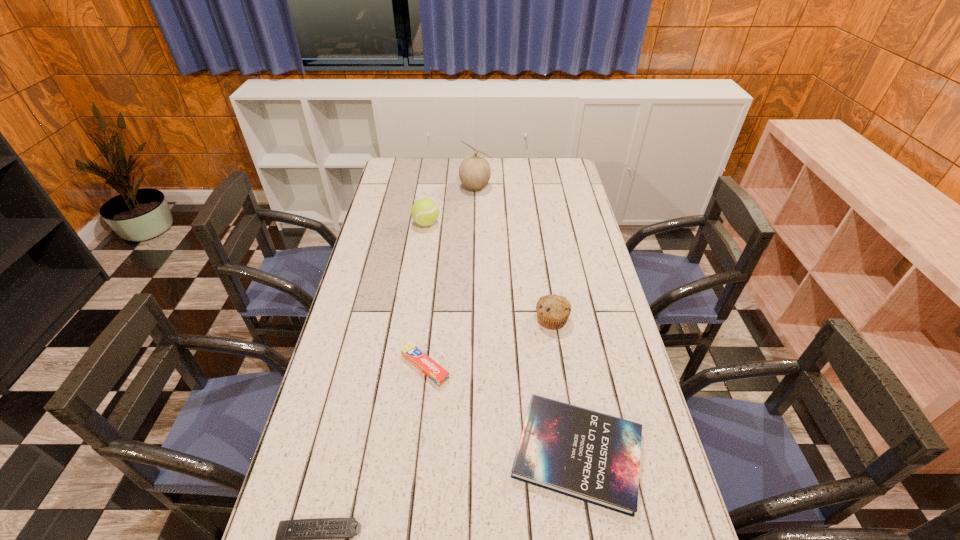
Where is `free space located on the right of the muffin`? The width and height of the screenshot is (960, 540). free space located on the right of the muffin is located at coordinates (600, 319).

I want to click on vacant area located 0.340m on the front of the fourth farthest object, so pos(409,517).

What are the coordinates of `free point located on the left of the second nearest object` in the screenshot? It's located at (449, 453).

Locate an element on the screen. This screenshot has width=960, height=540. object that is at the far edge is located at coordinates (474, 172).

The width and height of the screenshot is (960, 540). I want to click on muffin located at the right edge, so click(x=553, y=311).

Identify the location of hardback book that is at the right edge. (594, 457).

The height and width of the screenshot is (540, 960). I want to click on free space at the far edge, so click(x=538, y=181).

The height and width of the screenshot is (540, 960). In the image, there is a desktop. Find the location of `vacant area at the left edge`. vacant area at the left edge is located at coordinates (350, 459).

Locate an element on the screen. vacant space at the right edge of the desktop is located at coordinates (566, 274).

I want to click on vacant space at the far right corner, so click(545, 181).